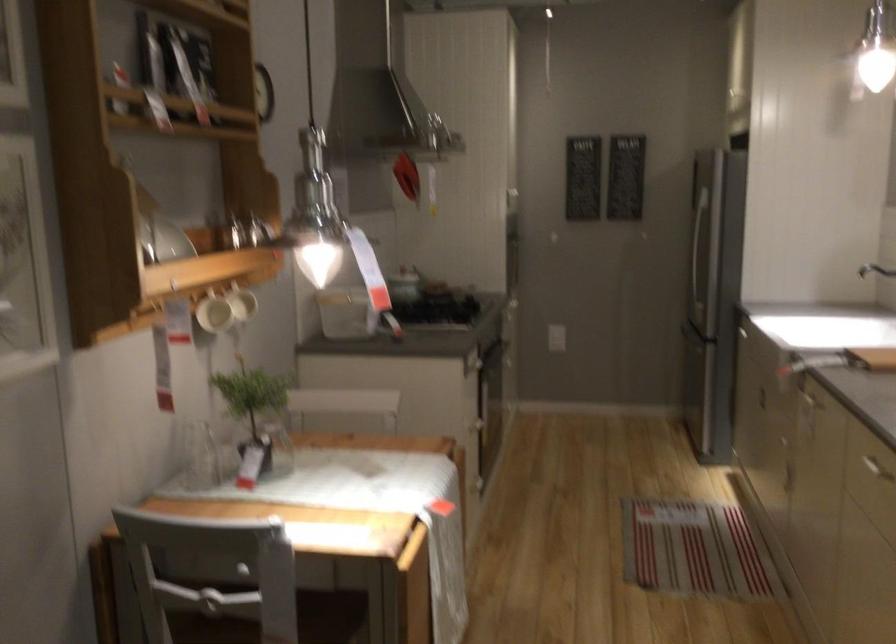
Find the location of a particular element. oven door handle is located at coordinates (489, 354).